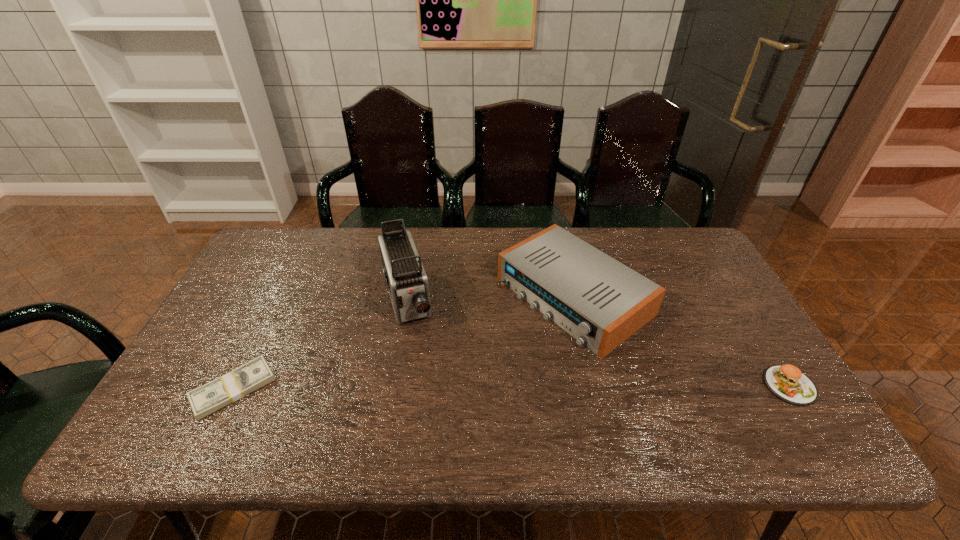
Where is `free spot between the rightmost object and the shortest object`? This screenshot has height=540, width=960. free spot between the rightmost object and the shortest object is located at coordinates (512, 387).

Image resolution: width=960 pixels, height=540 pixels. Identify the location of vacant point located between the dollar and the tallest object. (x=321, y=344).

The image size is (960, 540). Find the location of `vacant space in between the third tallest object and the leftmost object`. vacant space in between the third tallest object and the leftmost object is located at coordinates 512,387.

Identify the location of free space between the third object from left to right and the camcorder. (491, 298).

Where is `object that is the second closest to the third tallest object`? The image size is (960, 540). object that is the second closest to the third tallest object is located at coordinates (406, 280).

You are a GUI agent. You are given a task and a screenshot of the screen. Output one action in this format:
    pyautogui.click(x=<x>, y=<y>)
    Task: Click on the object that is the third closest to the third tallest object
    The height and width of the screenshot is (540, 960).
    Given the screenshot: What is the action you would take?
    pyautogui.click(x=204, y=400)

Locate an element on the screen. This screenshot has height=540, width=960. free location that satisfies the following two spatial constraints: 1. on the front side of the second object from left to right; 2. on the left side of the third tallest object is located at coordinates (392, 386).